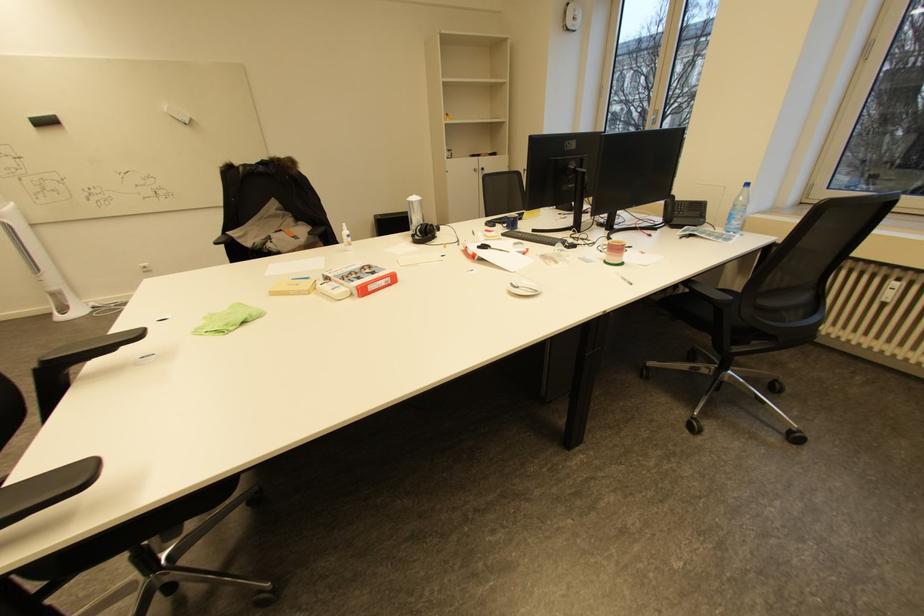
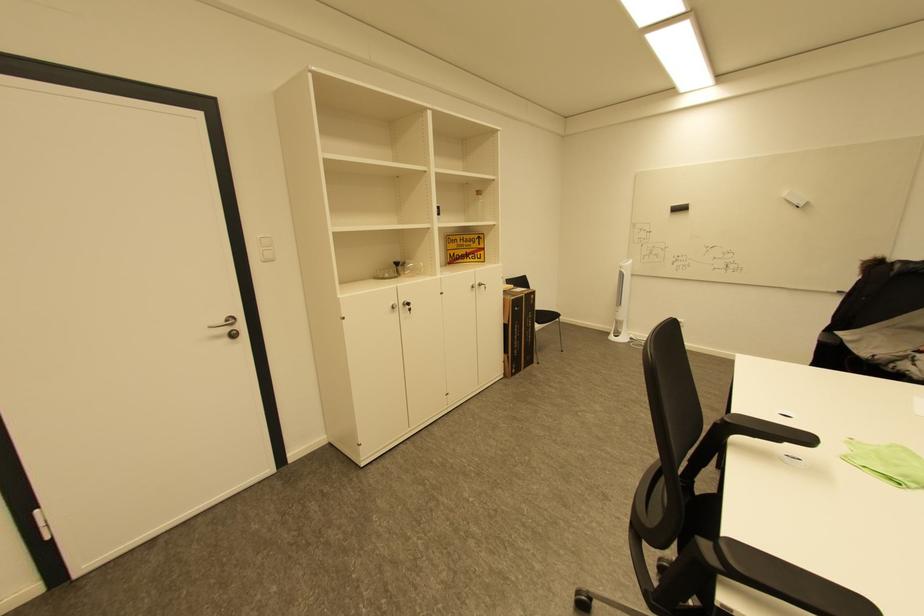
In the second image, find the point that corresponds to the point at 232,326 in the first image.

(910, 477)